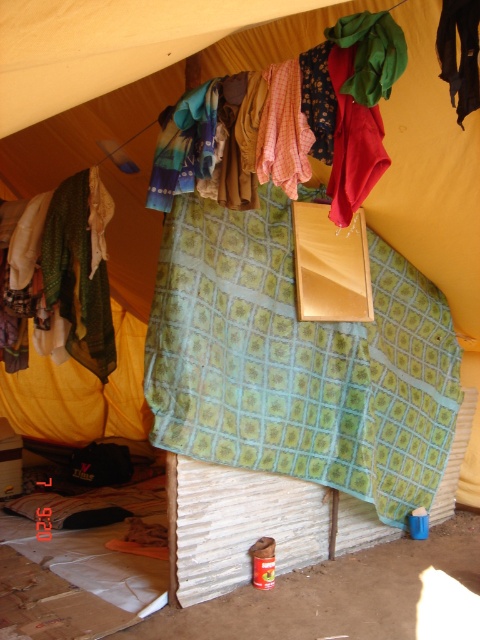
Who is more distant from viewer, (371, 426) or (348, 124)?

Positioned behind is point (371, 426).

Based on the photo, can you confirm if green patterned fabric at center is shorter than multicolored fabric at upper center?

No, green patterned fabric at center is not shorter than multicolored fabric at upper center.

Is point (177, 289) closer to camera compared to point (368, 96)?

No, it is behind (368, 96).

This screenshot has width=480, height=640. Find the location of `green patterned fabric at center`. green patterned fabric at center is located at coordinates (298, 362).

Which is in front, point (297, 192) or point (71, 324)?

Point (297, 192) is in front.

Image resolution: width=480 pixels, height=640 pixels. I want to click on multicolored fabric at upper center, so click(237, 138).

Locate an element on the screen. The image size is (480, 640). multicolored fabric at upper center is located at coordinates (237, 138).

Is green fabric at left further to camera compared to red cotton cloth at center?

Yes, green fabric at left is further from the viewer.

Can you confirm if green fabric at left is positioned to the right of red cotton cloth at center?

No, green fabric at left is not to the right of red cotton cloth at center.

Image resolution: width=480 pixels, height=640 pixels. What do you see at coordinates (67, 266) in the screenshot?
I see `green fabric at left` at bounding box center [67, 266].

Locate an element on the screen. This screenshot has width=480, height=640. green fabric at left is located at coordinates (67, 266).